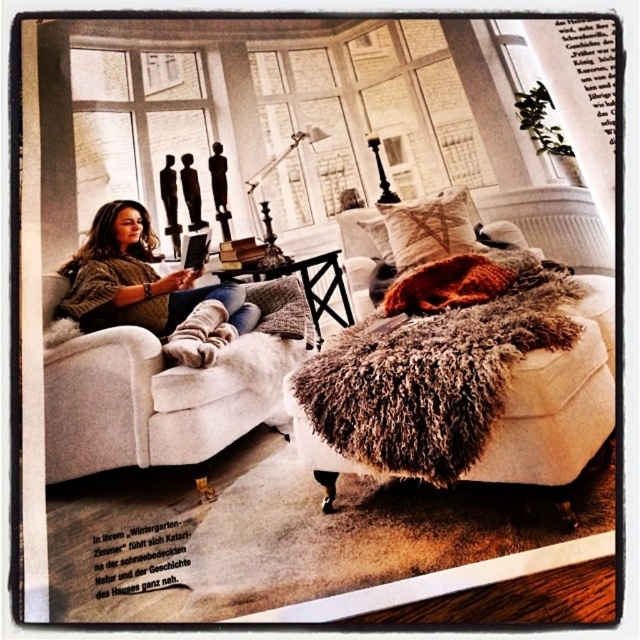
Question: Does beige fabric couch at center have a larger size compared to white soft fabric at center?

Choices:
 (A) no
 (B) yes

Answer: (B)

Question: Is fuzzy fabric ottoman at center bigger than knitted sweater at center?

Choices:
 (A) yes
 (B) no

Answer: (A)

Question: Which point is farther to the camera?

Choices:
 (A) fuzzy fabric ottoman at center
 (B) knitted sweater at center
 (C) textured beige pillow at center
 (D) textured beige pillow at upper right

Answer: (D)

Question: Among these points, which one is farthest from the camera?

Choices:
 (A) (458, 451)
 (B) (291, 300)
 (C) (52, 432)

Answer: (B)

Question: Is beige fabric couch at center below textured beige pillow at center?

Choices:
 (A) no
 (B) yes

Answer: (B)

Question: Estimate the real-world distances between objects in this image. Which object is farther from the fuzzy fabric ottoman at center?

Choices:
 (A) knitted sweater at center
 (B) white soft fabric at center

Answer: (B)